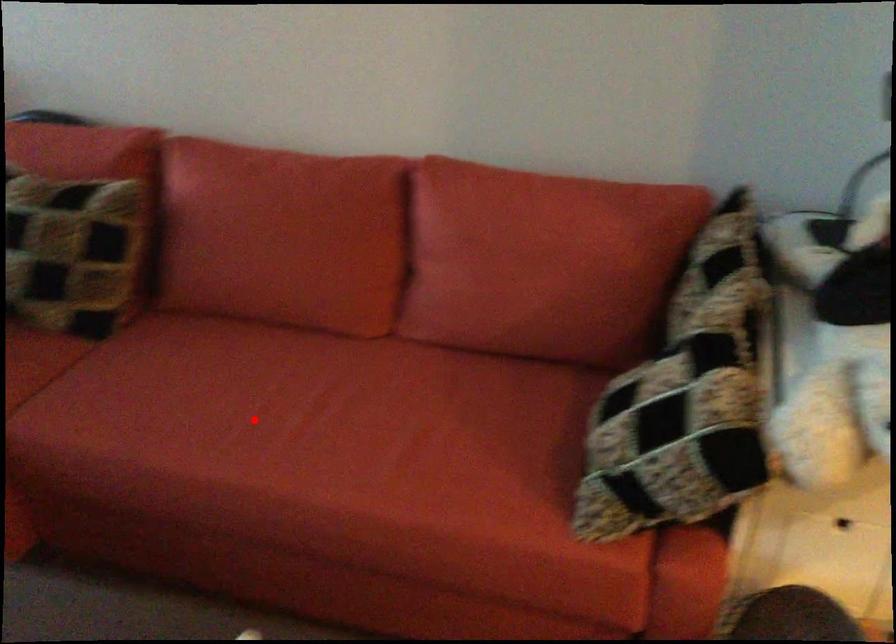
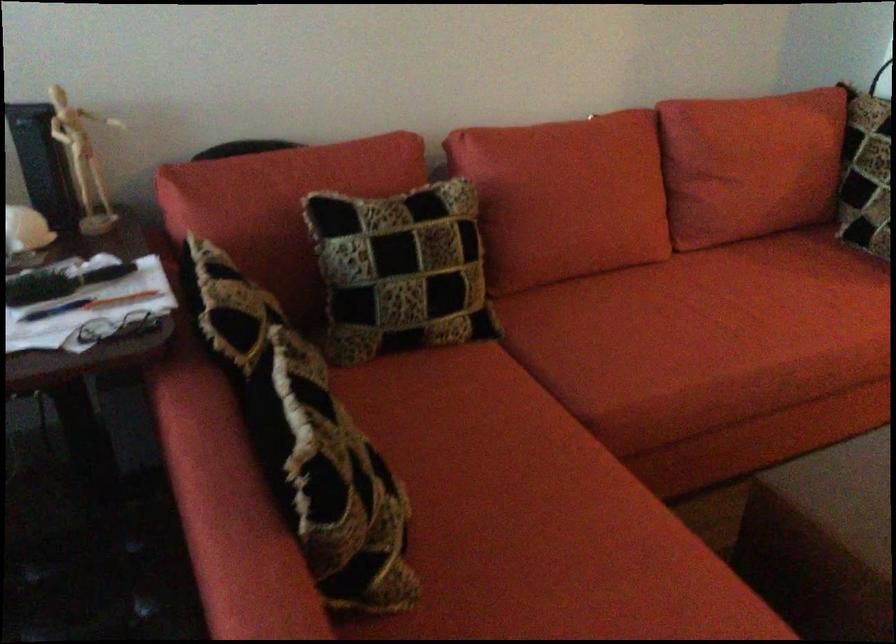
Question: I am providing you with two images of the same scene from different viewpoints. Given a red point in image1, look at the same physical point in image2. Is it:

Choices:
 (A) Closer to the viewpoint
 (B) Farther from the viewpoint

Answer: (B)